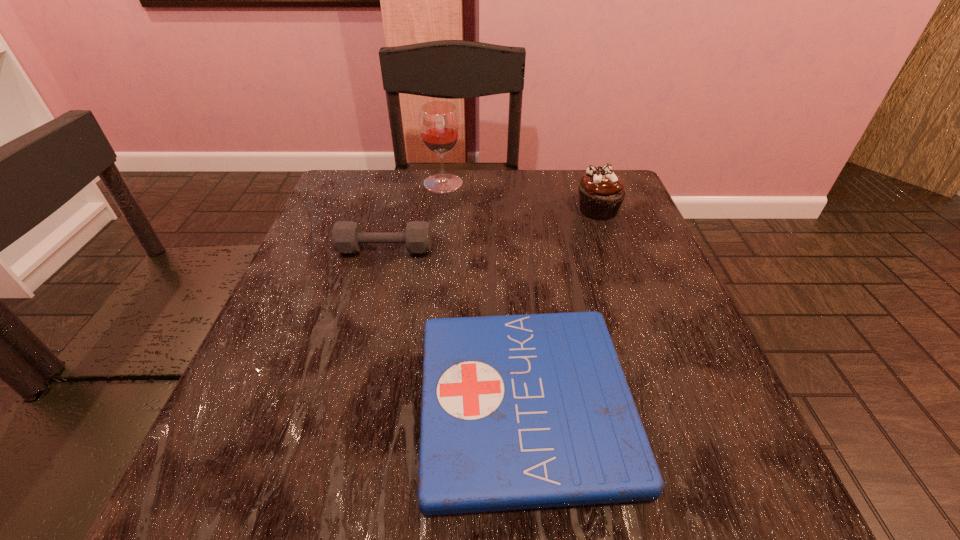
At what (x,y) coordinates should I click in order to perform the action: click on vacant area situated on the back of the second shortest object. Please return your answer as a coordinate pair (x, y). Looking at the image, I should click on (399, 194).

Image resolution: width=960 pixels, height=540 pixels. In order to click on vacant area situated on the back of the shortest object in this screenshot , I will do `click(510, 220)`.

Identify the location of wineglass that is at the far edge. (439, 124).

You are a GUI agent. You are given a task and a screenshot of the screen. Output one action in this format:
    pyautogui.click(x=<x>, y=<y>)
    Task: Click on the cupcake that is positioned at the far edge
    The image size is (960, 540).
    Given the screenshot: What is the action you would take?
    pyautogui.click(x=601, y=193)

Locate an element on the screen. object at the near edge is located at coordinates (528, 411).

This screenshot has height=540, width=960. Identify the location of object positioned at the left edge. (347, 237).

You are a GUI agent. You are given a task and a screenshot of the screen. Output one action in this format:
    pyautogui.click(x=<x>, y=<y>)
    Task: Click on the cupcake situated at the right edge
    
    Given the screenshot: What is the action you would take?
    pyautogui.click(x=601, y=193)

Where is `the first-aid kit that is positioned at the right edge`? The width and height of the screenshot is (960, 540). the first-aid kit that is positioned at the right edge is located at coordinates (528, 411).

Locate an element on the screen. This screenshot has width=960, height=540. object located at the far right corner is located at coordinates (601, 193).

Locate an element on the screen. This screenshot has width=960, height=540. object present at the near right corner is located at coordinates (528, 411).